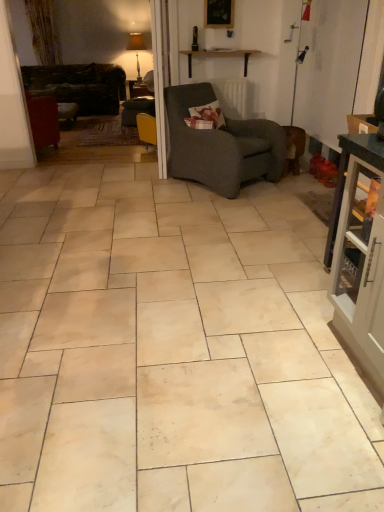
The height and width of the screenshot is (512, 384). What are the coordinates of `free spot above beige marble tile at center (from a real-world perspective)` in the screenshot? It's located at (164, 260).